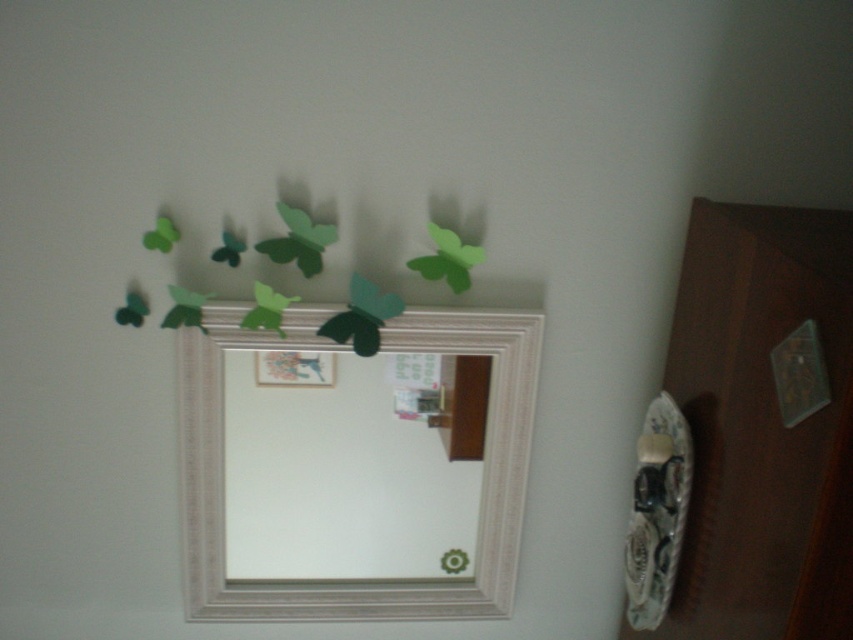
Consider the image. You are standing in the room and want to place a new decorative item between the wooden dresser at lower right and the white textured picture frame at upper center. Based on their positions, where should you place the item?

The wooden dresser at lower right is positioned on the right side of the white textured picture frame at upper center, so you should place the new decorative item between them, ensuring it is aligned between the two objects.

You are moving a small plant that is 5 inches wide. You want to place it between the wooden dresser at lower right and the white textured picture frame at upper center. Is there enough space for the plant?

The wooden dresser at lower right is 13.90 inches away from the white textured picture frame at upper center. Since the plant is 5 inches wide, there is enough space between them to place the plant.